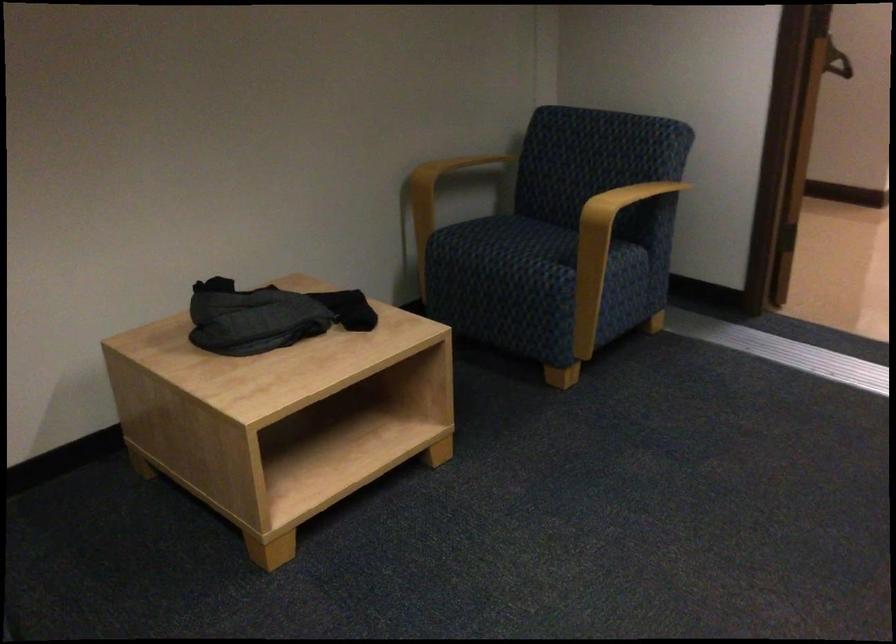
Which object does [837,61] point to?

This point indicates the black coat hanger.